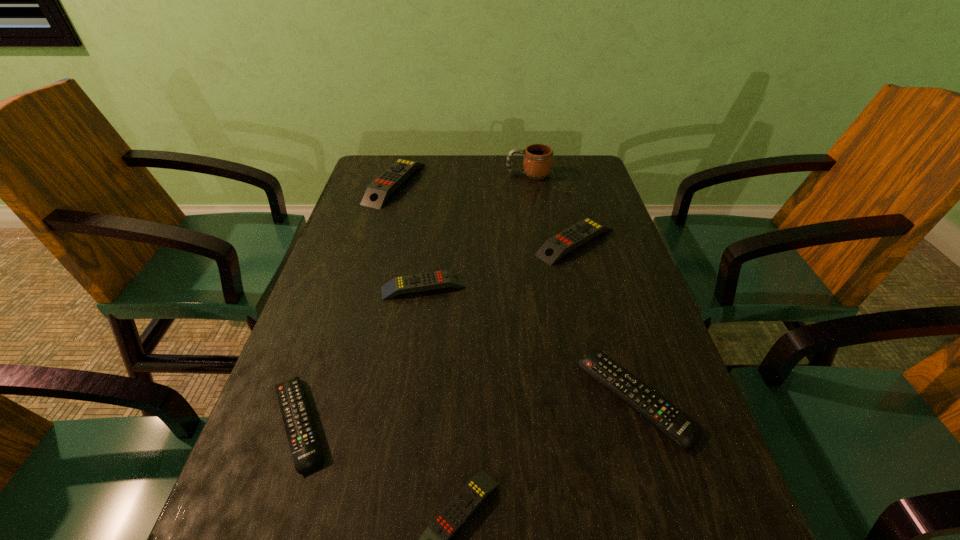
Locate an element on the screen. This screenshot has width=960, height=540. free spot between the tallest remote control and the left black remote control is located at coordinates (348, 303).

Locate which object ranks fifth in proximity to the sixth shortest object. Please provide its 2D coordinates. Your answer should be formatted as a tuple, i.e. [(x, y)], where the tuple contains the x and y coordinates of a point satisfying the conditions above.

[(679, 427)]

Select which object is the fourth closest to the nearest yellow remote control. Please provide its 2D coordinates. Your answer should be formatted as a tuple, i.e. [(x, y)], where the tuple contains the x and y coordinates of a point satisfying the conditions above.

[(554, 248)]

Locate which remote control is the fifth closest to the third biggest yellow remote control. Please provide its 2D coordinates. Your answer should be formatted as a tuple, i.e. [(x, y)], where the tuple contains the x and y coordinates of a point satisfying the conditions above.

[(435, 539)]

Select which remote control is the second closest to the sixth shortest object. Please provide its 2D coordinates. Your answer should be formatted as a tuple, i.e. [(x, y)], where the tuple contains the x and y coordinates of a point satisfying the conditions above.

[(554, 248)]

Identify the location of yellow remote control object that ranks as the third closest to the farthest yellow remote control. Image resolution: width=960 pixels, height=540 pixels. (435, 539).

Identify which yellow remote control is the nearest to the smaller black remote control. Please provide its 2D coordinates. Your answer should be formatted as a tuple, i.e. [(x, y)], where the tuple contains the x and y coordinates of a point satisfying the conditions above.

[(435, 539)]

Where is `black remote control that stands as the closest to the tallest object`? The width and height of the screenshot is (960, 540). black remote control that stands as the closest to the tallest object is located at coordinates (679, 427).

Locate an element on the screen. This screenshot has width=960, height=540. the second closest black remote control relative to the tallest object is located at coordinates (307, 456).

You are a GUI agent. You are given a task and a screenshot of the screen. Output one action in this format:
    pyautogui.click(x=<x>, y=<y>)
    Task: Click on the vacant region that satisfies the following two spatial constraints: 1. on the side of the fifth nearest object with the handle; 2. on the right side of the mug
    
    Given the screenshot: What is the action you would take?
    pyautogui.click(x=540, y=241)